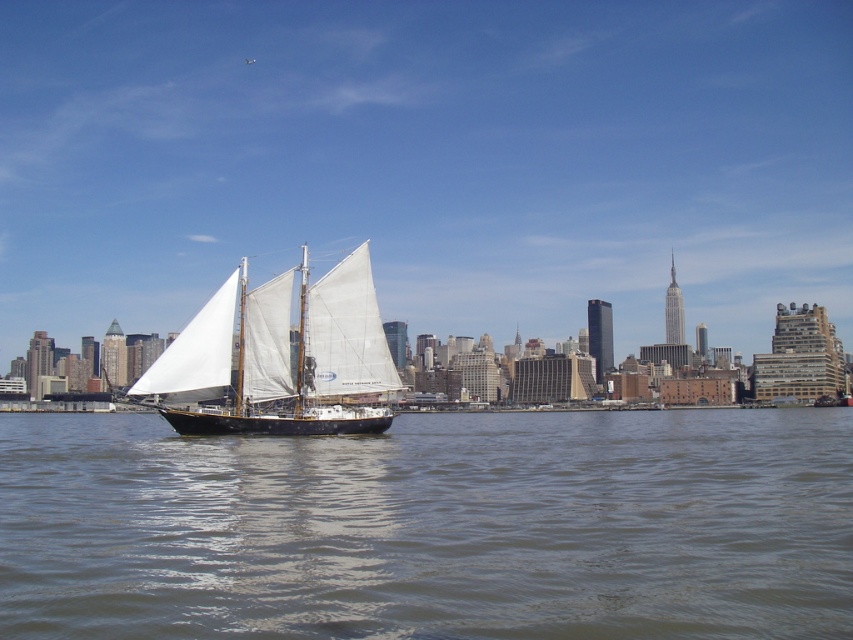
You are an observer standing on the riverbank and see the brown water at center and the white matte sailboat at center. Which object is closer to you?

The brown water at center is closer to you because it is in front of the white matte sailboat at center.

You are a photographer planning to capture the white matte sailboat at center and the brown water at center in a wide shot. Based on the scene, which object will occupy a larger portion of the photo?

The brown water at center will occupy a larger portion of the photo because its width is larger than the white matte sailboat at center.